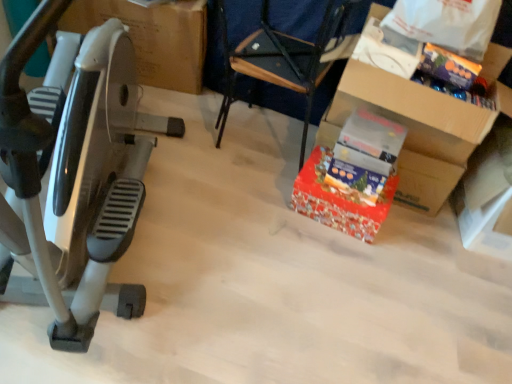
Locate an element on the screen. free point in front of red glossy gift at center, positioned as the 1th gift in bottom-to-top order is located at coordinates (337, 261).